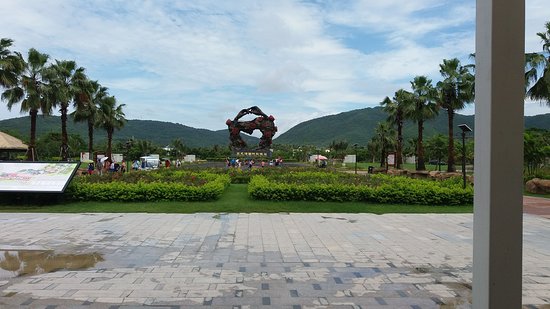
Where is `trash can`? The height and width of the screenshot is (309, 550). trash can is located at coordinates (371, 172).